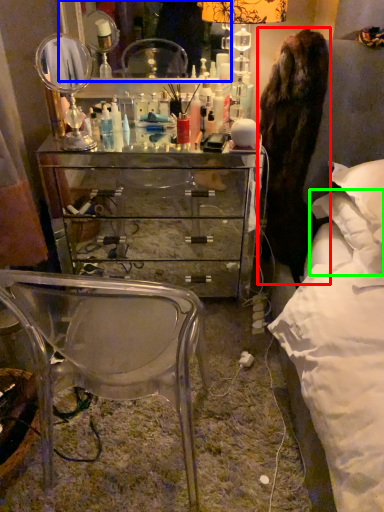
Question: Which object is positioned farthest from fur coat (highlighted by a red box)? Select from mirror (highlighted by a blue box) and pillow (highlighted by a green box).

Choices:
 (A) mirror
 (B) pillow

Answer: (A)